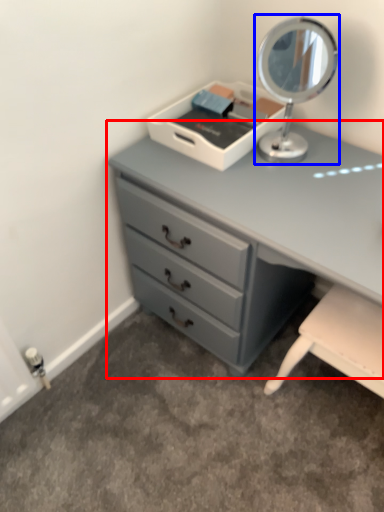
Question: Which of the following is the closest to the observer, chest of drawers (highlighted by a red box) or table lamp (highlighted by a blue box)?

Choices:
 (A) chest of drawers
 (B) table lamp

Answer: (A)